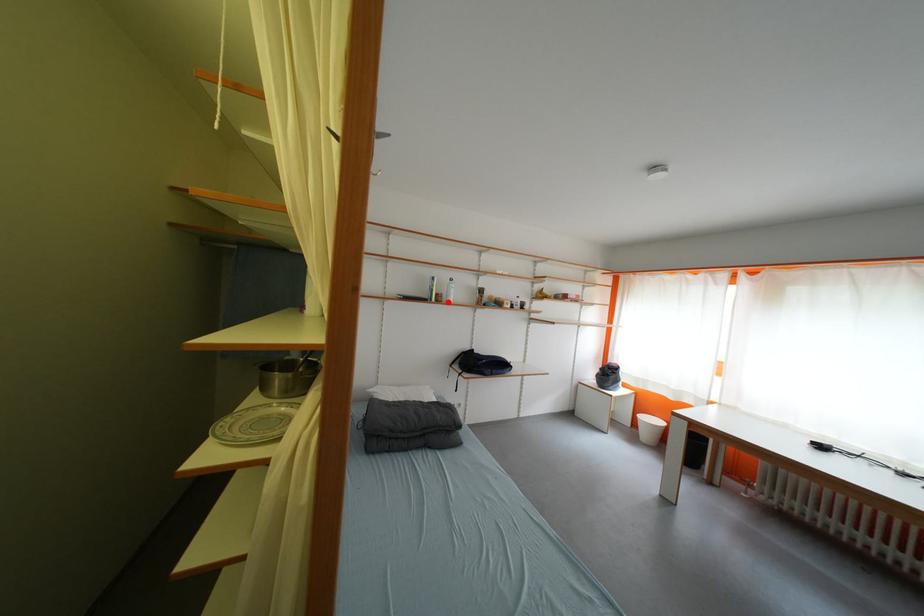
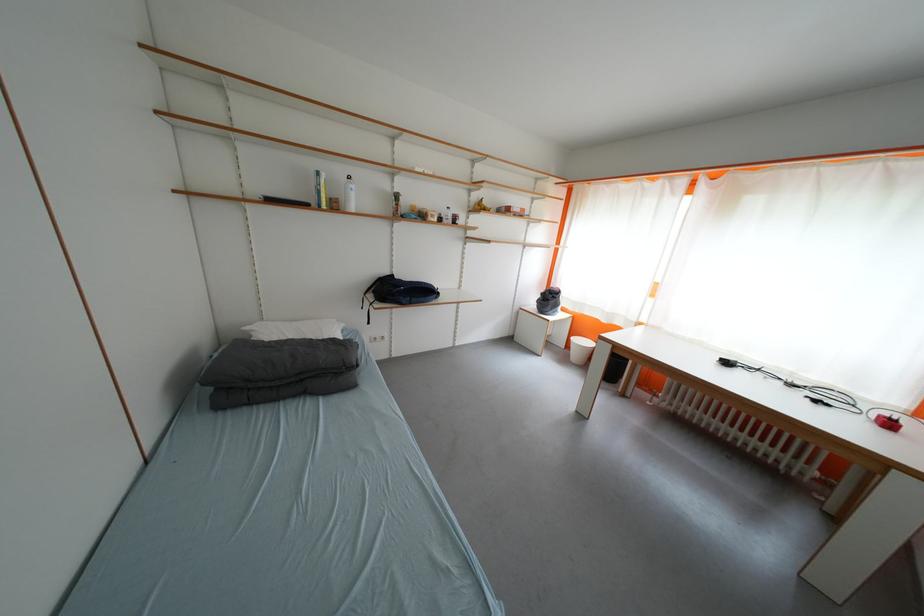
Find the pixel in the second image that matches the highlighted location in the first image.

(344, 209)